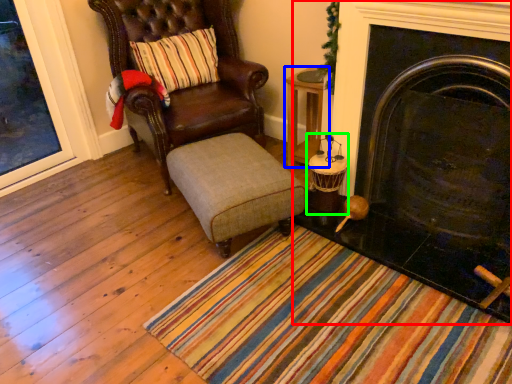
Question: Which object is the closest to the fireplace (highlighted by a red box)? Choose among these: table (highlighted by a blue box) or candle holder (highlighted by a green box).

Choices:
 (A) table
 (B) candle holder

Answer: (B)